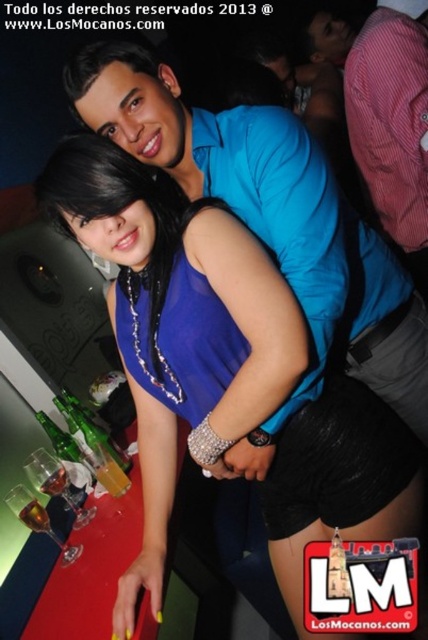
Is satin blue dress at center taller than blue shirt at upper center?

Correct, satin blue dress at center is much taller as blue shirt at upper center.

This screenshot has height=640, width=428. What do you see at coordinates (175, 321) in the screenshot?
I see `satin blue dress at center` at bounding box center [175, 321].

Where is `satin blue dress at center`? Image resolution: width=428 pixels, height=640 pixels. satin blue dress at center is located at coordinates (175, 321).